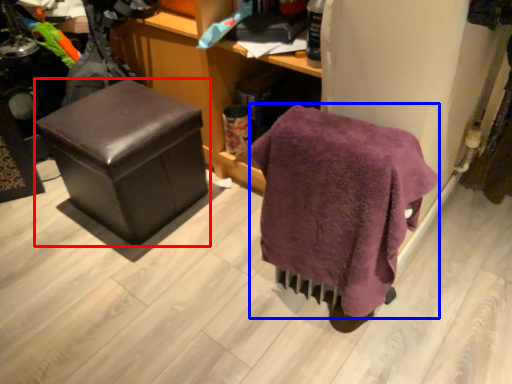
Question: Which of the following is the closest to the observer, furniture (highlighted by a red box) or bath towel (highlighted by a blue box)?

Choices:
 (A) furniture
 (B) bath towel

Answer: (B)